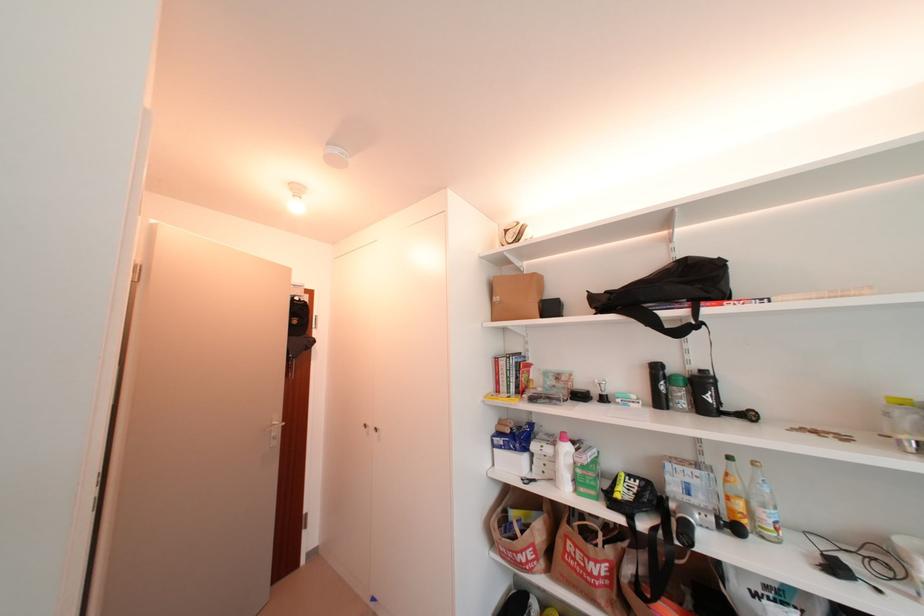
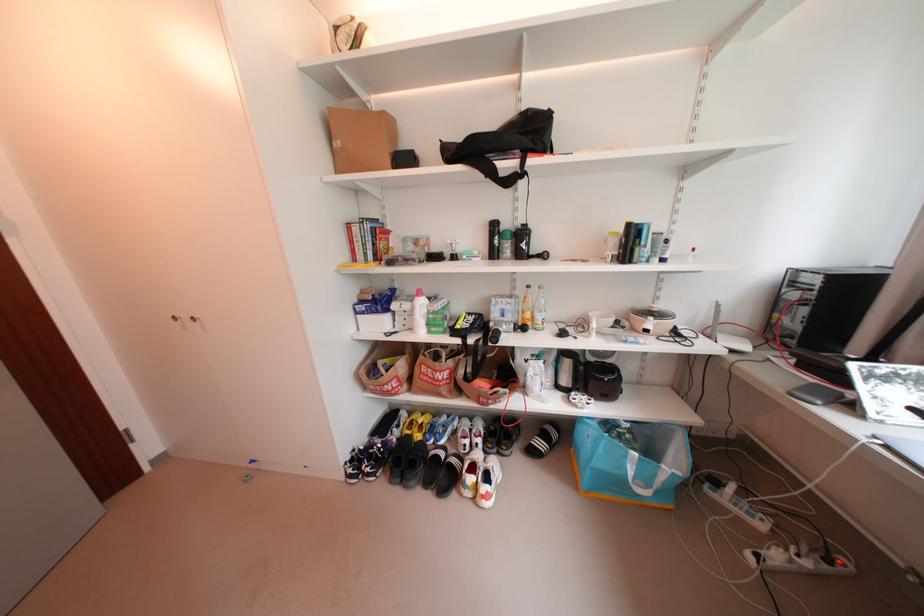
Locate, in the second image, the point that corresponds to (740,480) in the first image.

(536, 301)